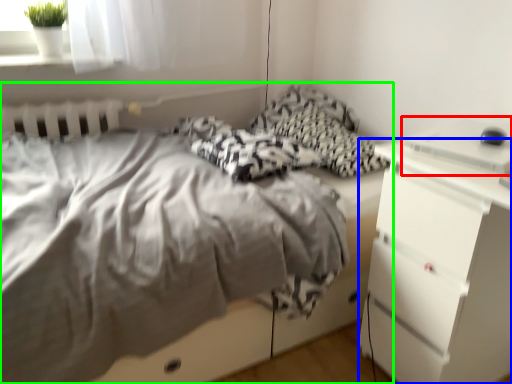
Question: Which is farther away from desktop (highlighted by a red box)? chest of drawers (highlighted by a blue box) or bed (highlighted by a green box)?

Choices:
 (A) chest of drawers
 (B) bed

Answer: (B)